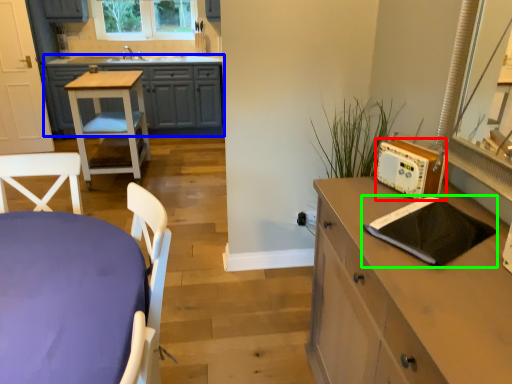
Question: Based on their relative distances, which object is nearer to appliance (highlighted by a red box)? Choose from cabinetry (highlighted by a blue box) and pad (highlighted by a green box).

Choices:
 (A) cabinetry
 (B) pad

Answer: (B)